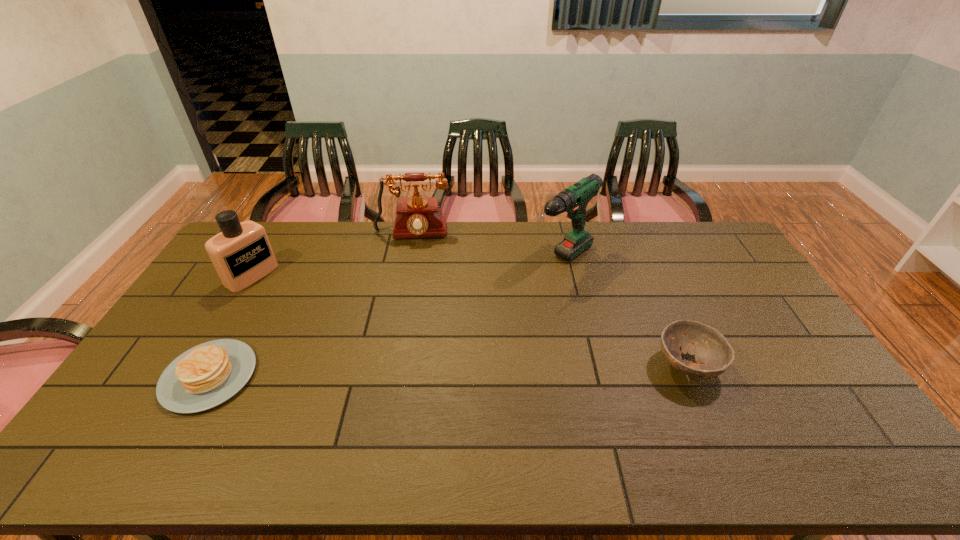
This screenshot has width=960, height=540. I want to click on free space on the desktop that is between the shortest object and the fourth tallest object and is positioned on the front label of the perfume, so click(x=416, y=372).

Find the location of a particular element. The height and width of the screenshot is (540, 960). vacant space on the desktop that is between the pancake and the bowl and is positioned on the handle side of the tallest object is located at coordinates 410,372.

The image size is (960, 540). Find the location of `vacant space on the desktop that is between the shortest object and the fourth tallest object and is positioned on the dial of the third object from left to right`. vacant space on the desktop that is between the shortest object and the fourth tallest object and is positioned on the dial of the third object from left to right is located at coordinates (400, 372).